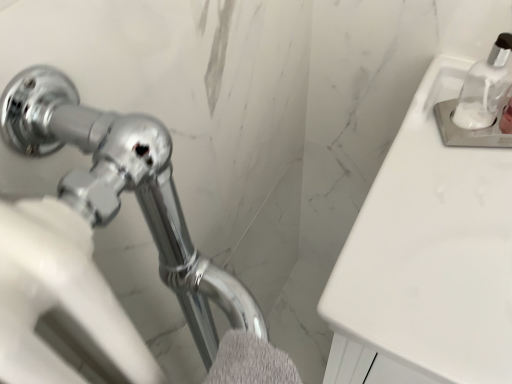
Question: Should I look upward or downward to see gray fluffy bath towel at lower center?

Choices:
 (A) down
 (B) up

Answer: (A)

Question: From a real-world perspective, does white glossy sink at upper right sit lower than clear glass soap dispenser at upper right?

Choices:
 (A) yes
 (B) no

Answer: (A)

Question: Is white glossy sink at upper right aimed at clear glass soap dispenser at upper right?

Choices:
 (A) yes
 (B) no

Answer: (B)

Question: Is the position of white glossy sink at upper right less distant than that of clear glass soap dispenser at upper right?

Choices:
 (A) yes
 (B) no

Answer: (A)

Question: Does white glossy sink at upper right have a smaller size compared to clear glass soap dispenser at upper right?

Choices:
 (A) yes
 (B) no

Answer: (B)

Question: Considering the relative sizes of white glossy sink at upper right and clear glass soap dispenser at upper right in the image provided, is white glossy sink at upper right bigger than clear glass soap dispenser at upper right?

Choices:
 (A) no
 (B) yes

Answer: (B)

Question: Is white glossy sink at upper right further to camera compared to clear glass soap dispenser at upper right?

Choices:
 (A) no
 (B) yes

Answer: (A)

Question: Is white glossy sink at upper right shorter than gray fluffy bath towel at lower center?

Choices:
 (A) yes
 (B) no

Answer: (B)

Question: Considering the relative sizes of white glossy sink at upper right and gray fluffy bath towel at lower center in the image provided, is white glossy sink at upper right bigger than gray fluffy bath towel at lower center?

Choices:
 (A) yes
 (B) no

Answer: (A)

Question: Is gray fluffy bath towel at lower center at the back of white glossy sink at upper right?

Choices:
 (A) no
 (B) yes

Answer: (A)

Question: Is white glossy sink at upper right further to the viewer compared to gray fluffy bath towel at lower center?

Choices:
 (A) yes
 (B) no

Answer: (A)

Question: From a real-world perspective, is white glossy sink at upper right physically above gray fluffy bath towel at lower center?

Choices:
 (A) yes
 (B) no

Answer: (B)

Question: From a real-world perspective, is white glossy sink at upper right located beneath gray fluffy bath towel at lower center?

Choices:
 (A) no
 (B) yes

Answer: (B)

Question: Does gray fluffy bath towel at lower center appear on the left side of white glossy sink at upper right?

Choices:
 (A) yes
 (B) no

Answer: (A)